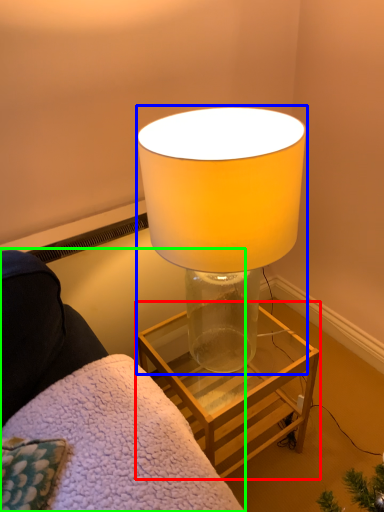
Question: Estimate the real-world distances between objects in this image. Which object is closer to table (highlighted by a red box), lamp (highlighted by a blue box) or furniture (highlighted by a green box)?

Choices:
 (A) lamp
 (B) furniture

Answer: (B)